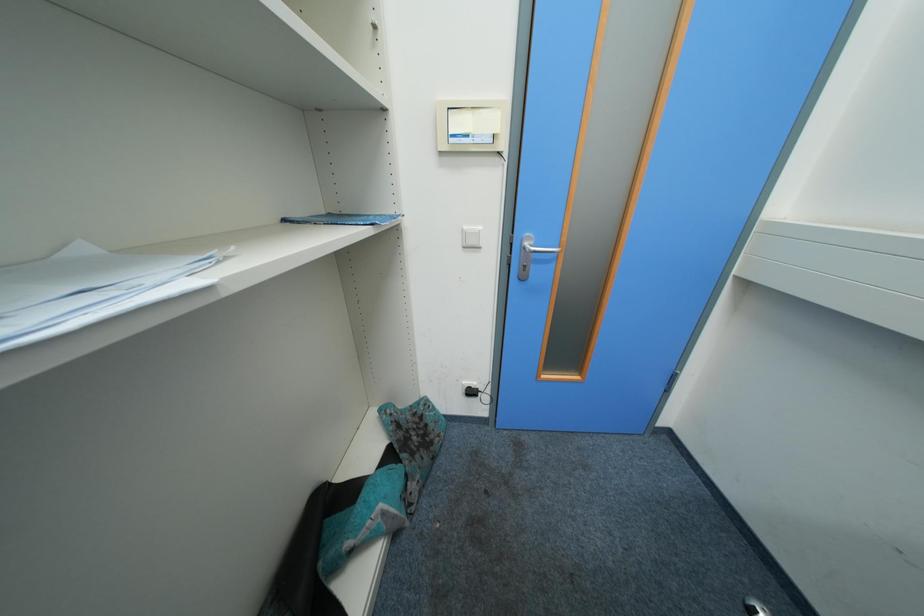
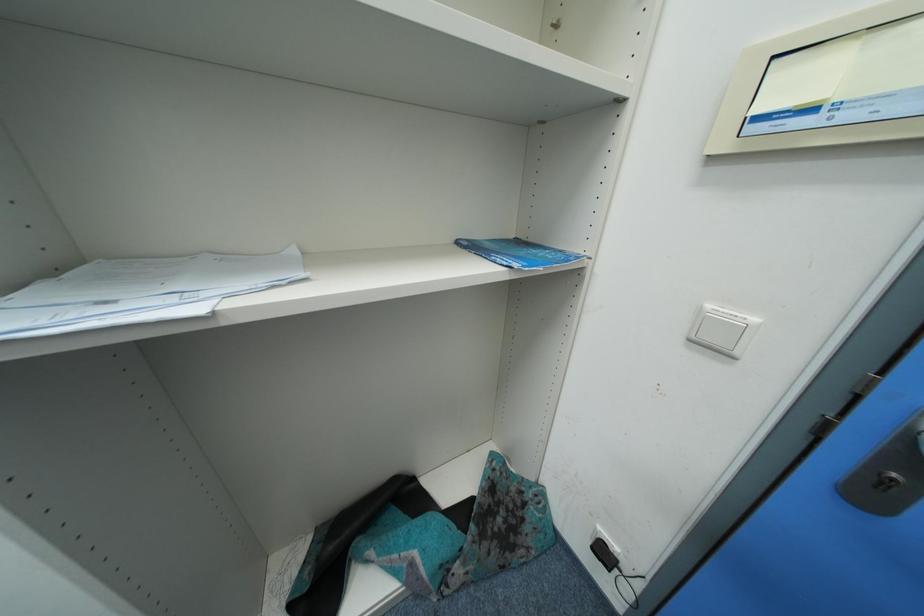
Question: The camera is either moving clockwise (left) or counter-clockwise (right) around the object. The first image is from the beginning of the video and the second image is from the end. Is the camera moving left or right when shooting the video?

Choices:
 (A) Left
 (B) Right

Answer: (B)